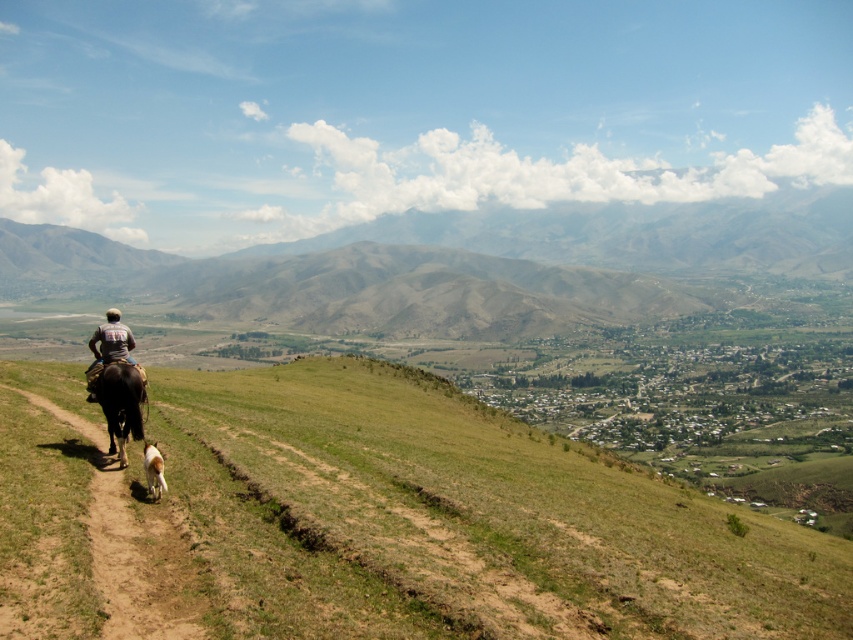
Can you confirm if green grassy hillside at center is taller than black glossy horse at lower left?

Correct, green grassy hillside at center is much taller as black glossy horse at lower left.

Which is in front, point (422, 620) or point (128, 394)?

Positioned in front is point (422, 620).

Image resolution: width=853 pixels, height=640 pixels. Describe the element at coordinates (370, 522) in the screenshot. I see `green grassy hillside at center` at that location.

You are a GUI agent. You are given a task and a screenshot of the screen. Output one action in this format:
    pyautogui.click(x=<x>, y=<y>)
    Task: Click on the green grassy hillside at center
    
    Given the screenshot: What is the action you would take?
    pyautogui.click(x=370, y=522)

Consider the image. Between green grassy hill at center and white fur dog at lower left, which one is positioned higher?

green grassy hill at center

Does green grassy hill at center appear under white fur dog at lower left?

Incorrect, green grassy hill at center is not positioned below white fur dog at lower left.

Is point (732, 304) positioned after point (155, 499)?

That is True.

At what (x,y) coordinates should I click in order to perform the action: click on green grassy hill at center. Please return your answer as a coordinate pair (x, y). Looking at the image, I should click on (462, 266).

Who is positioned more to the left, green grassy hillside at center or green grassy hill at center?

green grassy hillside at center is more to the left.

Find the location of a particular element. Image resolution: width=853 pixels, height=640 pixels. green grassy hillside at center is located at coordinates click(x=370, y=522).